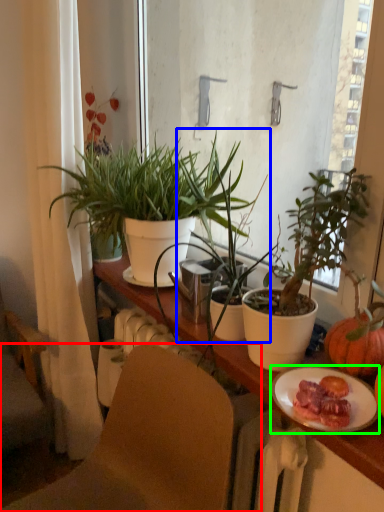
Question: Which is farther away from chair (highlighted by a red box)? houseplant (highlighted by a blue box) or plate (highlighted by a green box)?

Choices:
 (A) houseplant
 (B) plate

Answer: (A)